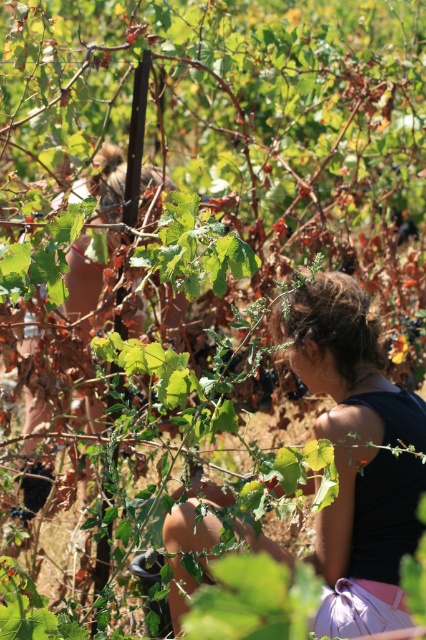
Consider the image. You are navigating through the vineyard and need to reach a specific location. You have two points marked on your map, point A at coordinates point (370, 502) and point B at coordinates point (115, 150). Which point is closer to your current position if you are standing at the origin?

Point B at coordinates point (115, 150) is closer to the origin since it has smaller coordinate values than point A at coordinates point (370, 502).

You are a photographer trying to capture a closeup of the person picking grapes. You notice two hair strands labeled dark brown hair at center and matte brown hair at center. Which hair strand should you focus on to ensure the subject is sharp in the photo?

You should focus on the dark brown hair at center because it is closer to the viewer than the matte brown hair at center, making it the foreground element that needs sharp focus for clarity.

The scene shows a person picking grapes in a vineyard. There is a point labeled at coordinates (356, 456). What object is located at this point?

The point at coordinates (356, 456) indicates the dark brown hair at center.